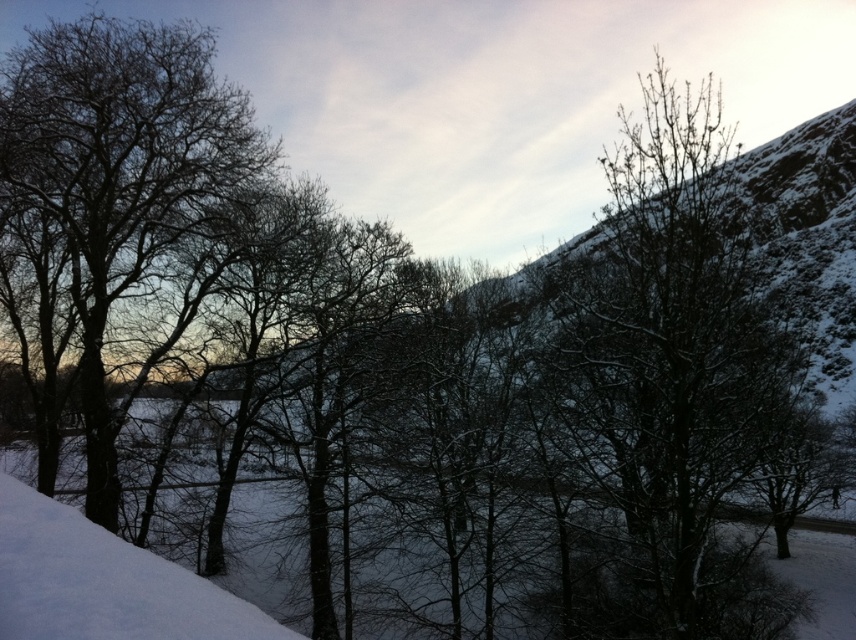
Question: Which point appears closest to the camera in this image?

Choices:
 (A) (146, 44)
 (B) (599, 356)

Answer: (B)

Question: Can you confirm if snow-covered tree at center is positioned below silvery snow-covered tree at left?

Choices:
 (A) no
 (B) yes

Answer: (A)

Question: Considering the relative positions of snow-covered tree at center and silvery snow-covered tree at left in the image provided, where is snow-covered tree at center located with respect to silvery snow-covered tree at left?

Choices:
 (A) right
 (B) left

Answer: (A)

Question: Is the position of snow-covered tree at center less distant than that of silvery snow-covered tree at left?

Choices:
 (A) no
 (B) yes

Answer: (B)